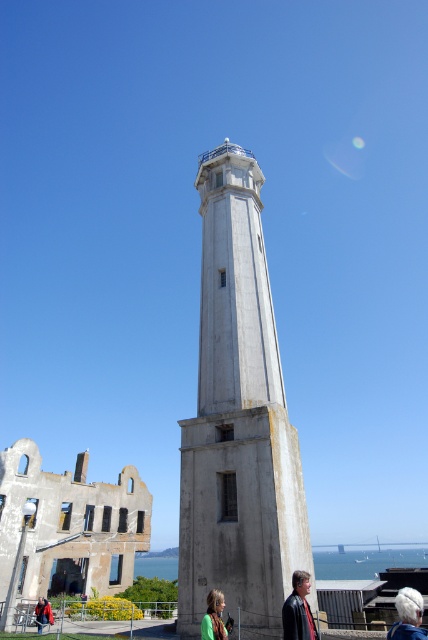
You are a photographer standing in front of the white concrete tower at center and the white hair at lower right. You want to take a photo that includes both objects in the frame. Which object should you focus on first to ensure both are in focus?

You should focus on the white concrete tower at center first because it is closer to you than the white hair at lower right, so focusing on the closer object will help ensure both are in focus.

In the scene shown: You are a tour guide leading a group to the observation deck of the white concrete tower at center. A tourist asks if they can walk from their current position at the green fabric jacket at lower center to the tower without any obstacles. What do you tell them?

The distance between the white concrete tower at center and the green fabric jacket at lower center is 11.63 meters. Since there are no mentioned obstacles in the scene description, the tourist can walk directly to the tower.

You are a hiker who has just reached the summit and wants to take a photo. You see the white concrete tower at center and the green fabric jacket at lower center. Which object is higher up in the scene?

The white concrete tower at center is positioned over the green fabric jacket at lower center, so it is higher up in the scene.